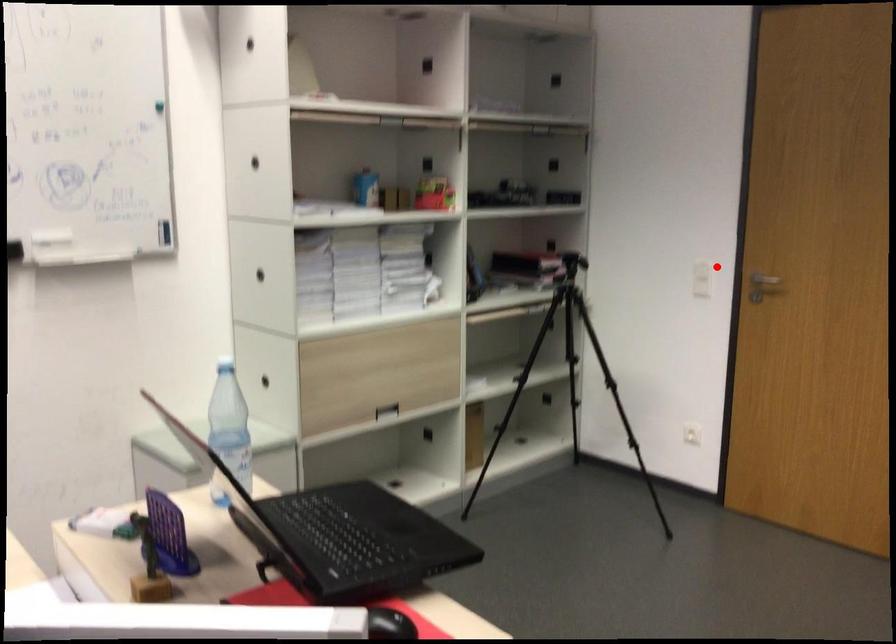
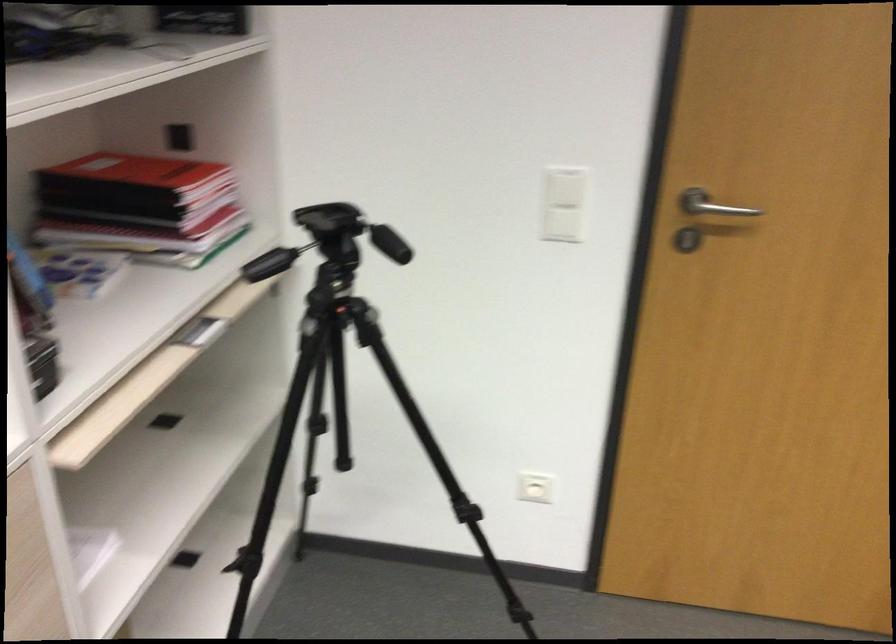
Question: I am providing you with two images of the same scene from different viewpoints. Image1 has a red point marked. In image2, the corresponding 3D location appears at what relative position? Reply with the corresponding letter.

Choices:
 (A) Closer
 (B) Farther

Answer: (A)